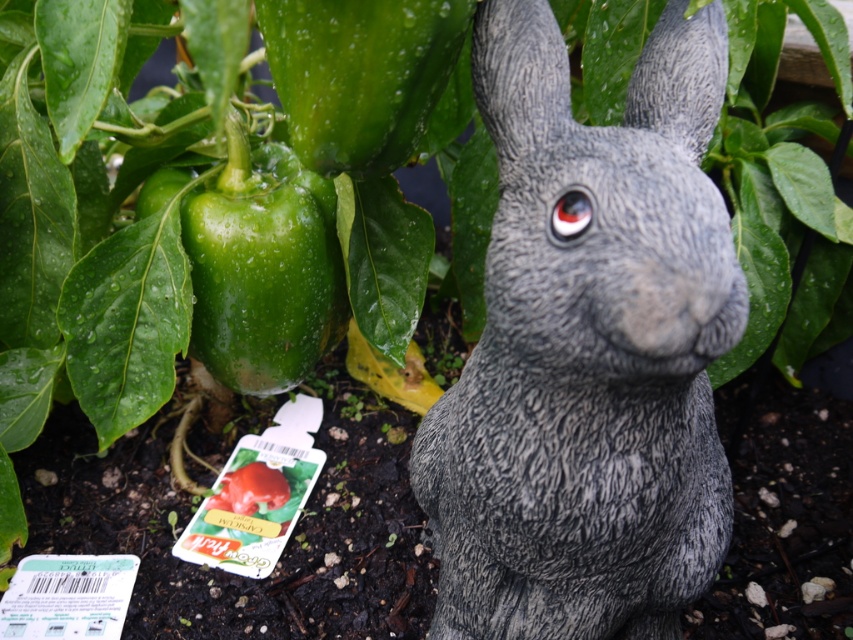
Which is more to the left, gray stone rabbit at center or green matte bell pepper at left?

green matte bell pepper at left

This screenshot has width=853, height=640. Describe the element at coordinates (589, 348) in the screenshot. I see `gray stone rabbit at center` at that location.

Based on the photo, who is more distant from viewer, (544, 90) or (213, 211)?

Positioned behind is point (213, 211).

This screenshot has width=853, height=640. In order to click on gray stone rabbit at center in this screenshot , I will do `click(589, 348)`.

Does green matte bell pepper at left come behind green matte bell pepper at upper left?

Yes, it is behind green matte bell pepper at upper left.

Between point (281, 268) and point (277, 60), which one is positioned behind?

Positioned behind is point (281, 268).

Which is in front, point (325, 182) or point (384, 65)?

Point (384, 65) is in front.

I want to click on green matte bell pepper at left, so click(262, 268).

Is gray stone rabbit at center bigger than green matte bell pepper at upper left?

Yes.

Can you confirm if gray stone rabbit at center is positioned to the right of green matte bell pepper at upper left?

Correct, you'll find gray stone rabbit at center to the right of green matte bell pepper at upper left.

At what (x,y) coordinates should I click in order to perform the action: click on gray stone rabbit at center. Please return your answer as a coordinate pair (x, y). The image size is (853, 640). Looking at the image, I should click on click(589, 348).